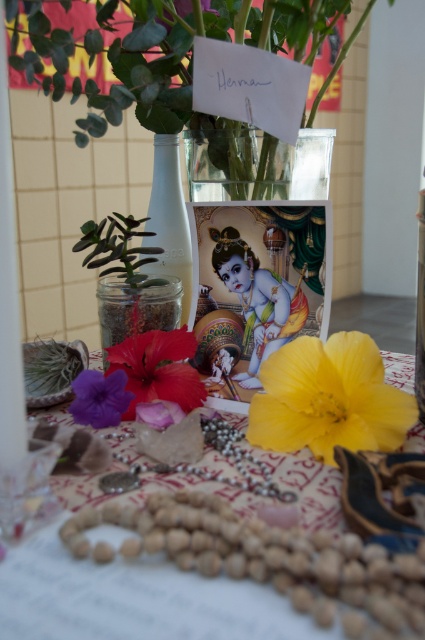
Does white matte bottle at center come behind green leafy plant at upper left?

Yes, white matte bottle at center is further from the viewer.

Which is more to the right, white matte bottle at center or green leafy plant at upper left?

green leafy plant at upper left is more to the right.

Does point (170, 188) lie in front of point (203, 4)?

Yes, point (170, 188) is closer to viewer.

Where is `white matte bottle at center`? This screenshot has height=640, width=425. white matte bottle at center is located at coordinates (169, 218).

Who is higher up, textured fabric tablecloth at center or smooth golden idol at center?

Positioned higher is smooth golden idol at center.

Can you confirm if textured fabric tablecloth at center is positioned below smooth golden idol at center?

Correct, textured fabric tablecloth at center is located below smooth golden idol at center.

This screenshot has width=425, height=640. I want to click on textured fabric tablecloth at center, so click(133, 600).

Is smooth golden idol at center bigger than purple matte flower at lower left?

Indeed, smooth golden idol at center has a larger size compared to purple matte flower at lower left.

Is point (252, 360) closer to camera compared to point (99, 404)?

No, it is behind (99, 404).

Is point (269, 340) positioned behind point (121, 412)?

That is True.

Where is `smooth golden idol at center`? This screenshot has width=425, height=640. smooth golden idol at center is located at coordinates (257, 300).